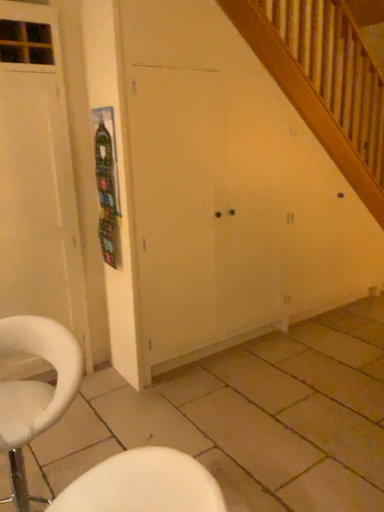
Find the location of `free space in front of white matte cabinet at center`. free space in front of white matte cabinet at center is located at coordinates (220, 411).